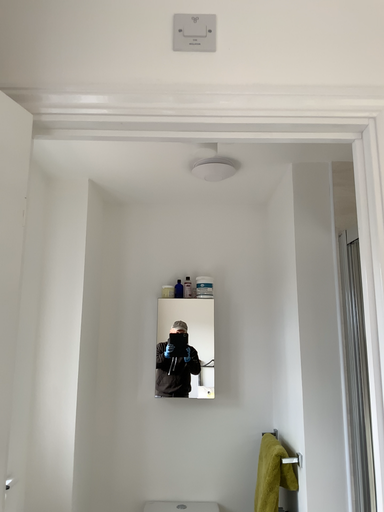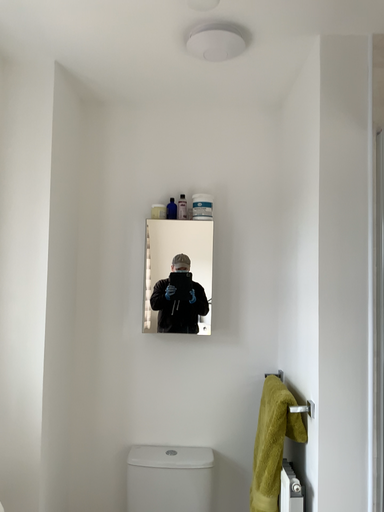
Question: Which way did the camera rotate in the video?

Choices:
 (A) rotated upward
 (B) rotated downward

Answer: (B)